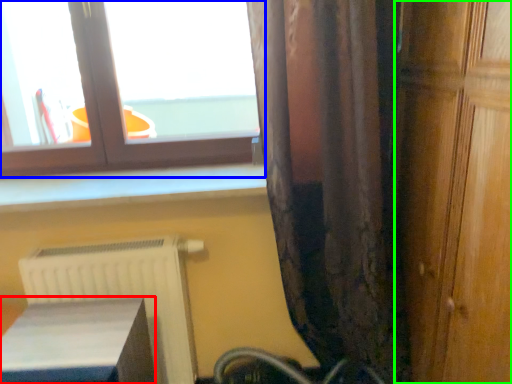
Question: Estimate the real-world distances between objects in this image. Which object is closer to furniture (highlighted by a red box), window (highlighted by a blue box) or door (highlighted by a green box)?

Choices:
 (A) window
 (B) door

Answer: (A)